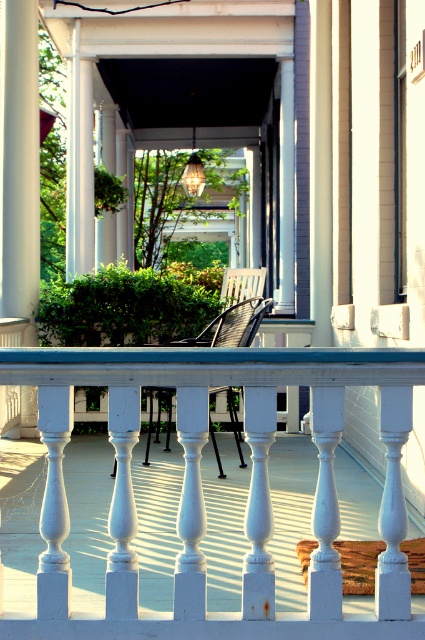
You are designing a porch layout and need to place a new small potted plant. Given the white painted wood balustrade at center and the black woven chair at center, which object should the plant be placed closer to if you want it to receive more sunlight?

The plant should be placed closer to the white painted wood balustrade at center because it has a smaller size compared to the black woven chair at center, allowing more sunlight to reach the plant.

You are sitting on the black woven chair at center and want to place a small potted plant on the white painted wood balustrade at center. Is the balustrade directly beneath the chair, making it easy to reach?

The white painted wood balustrade at center is located below the black woven chair at center, so yes, the balustrade is directly beneath the chair, making it easy to reach.

You are standing on the porch and want to place a small potted plant exactly at point (201, 486). What object will the potted plant be placed on?

The potted plant will be placed on the white painted wood balustrade at center located at point (201, 486).